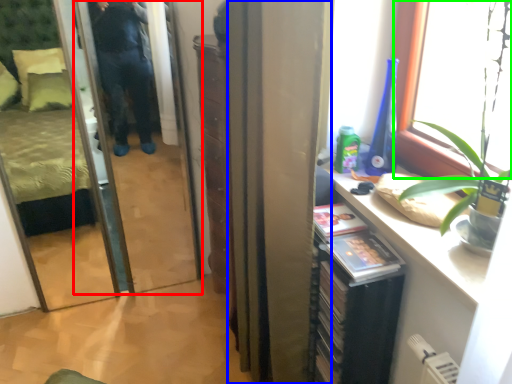
Question: Which is farther away from screen door (highlighted by a red box)? curtain (highlighted by a blue box) or window (highlighted by a green box)?

Choices:
 (A) curtain
 (B) window

Answer: (B)